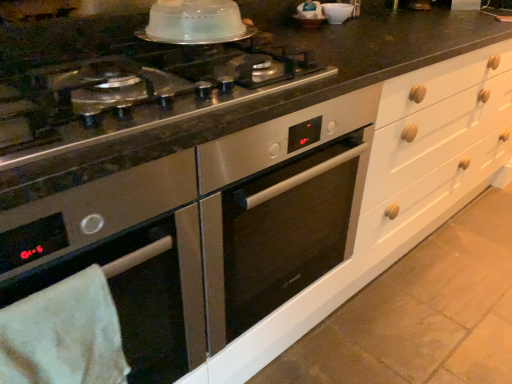
What is the approximate height of white towel at lower left?

The height of white towel at lower left is 13.37 inches.

What do you see at coordinates (195, 67) in the screenshot? I see `stainless steel cooktop at center` at bounding box center [195, 67].

Measure the distance between stainless steel cooktop at center and camera.

stainless steel cooktop at center is 22.44 inches from camera.

This screenshot has height=384, width=512. I want to click on white towel at lower left, so click(64, 335).

Is clear plastic dome at upper center at the right side of white towel at lower left?

Yes.

Does clear plastic dome at upper center touch white towel at lower left?

No, clear plastic dome at upper center is not touching white towel at lower left.

Considering the sizes of objects clear plastic dome at upper center and white towel at lower left in the image provided, who is wider, clear plastic dome at upper center or white towel at lower left?

clear plastic dome at upper center is wider.

Based on the photo, which object is closer to the camera, clear plastic dome at upper center or white towel at lower left?

white towel at lower left is more forward.

Identify the location of kitchen appliance that is on the right side of white towel at lower left. (195, 22).

Based on their positions, is white towel at lower left located to the left or right of clear plastic dome at upper center?

Clearly, white towel at lower left is on the left of clear plastic dome at upper center in the image.

Is white towel at lower left facing towards clear plastic dome at upper center?

No, white towel at lower left is not oriented towards clear plastic dome at upper center.

Is white towel at lower left not close to clear plastic dome at upper center?

That's not correct — white towel at lower left is a little close to clear plastic dome at upper center.

Can you confirm if clear plastic dome at upper center is positioned to the right of white glossy bowl at upper center?

No.

Is clear plastic dome at upper center further to camera compared to white glossy bowl at upper center?

No, clear plastic dome at upper center is in front of white glossy bowl at upper center.

How different are the orientations of clear plastic dome at upper center and white glossy bowl at upper center in degrees?

clear plastic dome at upper center and white glossy bowl at upper center are facing 4.16 degrees away from each other.

Is clear plastic dome at upper center situated inside white glossy bowl at upper center or outside?

clear plastic dome at upper center is not enclosed by white glossy bowl at upper center.

Does white glossy bowl at upper center lie in front of clear plastic dome at upper center?

No, white glossy bowl at upper center is further to the viewer.

Based on the photo, is white glossy bowl at upper center not near clear plastic dome at upper center?

white glossy bowl at upper center is actually quite close to clear plastic dome at upper center.

Is white towel at lower left touching stainless steel cooktop at center?

No, white towel at lower left is not making contact with stainless steel cooktop at center.

Is white towel at lower left in front of or behind stainless steel cooktop at center in the image?

Clearly, white towel at lower left is in front of stainless steel cooktop at center.

Is stainless steel cooktop at center surrounded by white towel at lower left?

No, stainless steel cooktop at center is not inside white towel at lower left.

Is stainless steel cooktop at center completely or partially outside of white towel at lower left?

stainless steel cooktop at center is positioned outside white towel at lower left.

In terms of width, does stainless steel cooktop at center look wider or thinner when compared to white towel at lower left?

Clearly, stainless steel cooktop at center has more width compared to white towel at lower left.

From the image's perspective, between stainless steel cooktop at center and white towel at lower left, which one is located above?

From the image's view, stainless steel cooktop at center is above.

Is stainless steel cooktop at center at the left side of white towel at lower left?

No.

Are clear plastic dome at upper center and stainless steel cooktop at center beside each other?

There is a gap between clear plastic dome at upper center and stainless steel cooktop at center.

Which is behind, clear plastic dome at upper center or stainless steel cooktop at center?

clear plastic dome at upper center is more distant.

How different are the orientations of clear plastic dome at upper center and stainless steel cooktop at center in degrees?

The angular difference between clear plastic dome at upper center and stainless steel cooktop at center is 1.13 degrees.

From the image's perspective, relative to stainless steel cooktop at center, is clear plastic dome at upper center above or below?

clear plastic dome at upper center is situated higher than stainless steel cooktop at center in the image.

This screenshot has height=384, width=512. I want to click on material that is below the clear plastic dome at upper center (from the image's perspective), so click(64, 335).

Identify the location of material in front of the clear plastic dome at upper center. (64, 335).

Looking at the image, which one is located closer to stainless steel cooktop at center, white towel at lower left or white glossy bowl at upper center?

white glossy bowl at upper center is positioned closer to the anchor stainless steel cooktop at center.

From the image, which object appears to be nearer to stainless steel cooktop at center, clear plastic dome at upper center or white glossy bowl at upper center?

Based on the image, clear plastic dome at upper center appears to be nearer to stainless steel cooktop at center.

From the image, which object appears to be farther from stainless steel cooktop at center, white glossy bowl at upper center or clear plastic dome at upper center?

white glossy bowl at upper center is positioned further to the anchor stainless steel cooktop at center.

When comparing their distances from stainless steel cooktop at center, does clear plastic dome at upper center or white towel at lower left seem closer?

The object closer to stainless steel cooktop at center is clear plastic dome at upper center.

Looking at this image, estimate the real-world distances between objects in this image. Which object is closer to clear plastic dome at upper center, white glossy bowl at upper center or white towel at lower left?

white glossy bowl at upper center lies closer to clear plastic dome at upper center than the other object.

When comparing their distances from white glossy bowl at upper center, does stainless steel cooktop at center or clear plastic dome at upper center seem closer?

stainless steel cooktop at center is closer to white glossy bowl at upper center.

Considering their positions, is white glossy bowl at upper center positioned further to white towel at lower left than clear plastic dome at upper center?

The object further to white towel at lower left is white glossy bowl at upper center.

Considering their positions, is stainless steel cooktop at center positioned closer to white towel at lower left than white glossy bowl at upper center?

stainless steel cooktop at center.

Locate an element on the screen. countertop between white towel at lower left and white glossy bowl at upper center in the front-back direction is located at coordinates (195, 67).

What are the coordinates of `countertop between clear plastic dome at upper center and white towel at lower left from top to bottom` in the screenshot? It's located at point(195,67).

Locate an element on the screen. The height and width of the screenshot is (384, 512). kitchen appliance between white towel at lower left and white glossy bowl at upper center from front to back is located at coordinates (195, 22).

This screenshot has height=384, width=512. What are the coordinates of `kitchen appliance between stainless steel cooktop at center and white glossy bowl at upper center along the z-axis` in the screenshot? It's located at (195, 22).